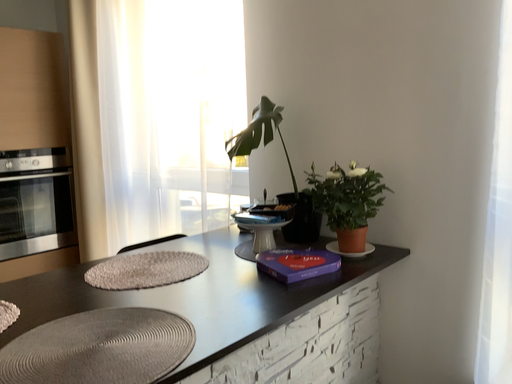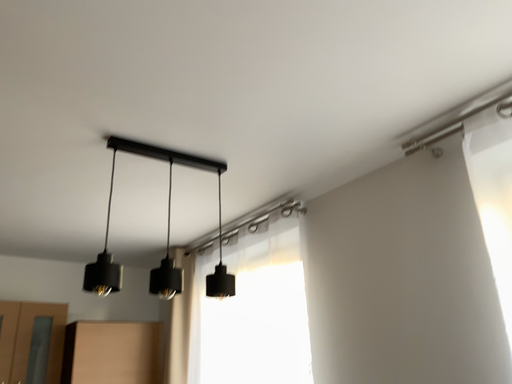
Question: Which way did the camera rotate in the video?

Choices:
 (A) rotated downward
 (B) rotated upward

Answer: (B)